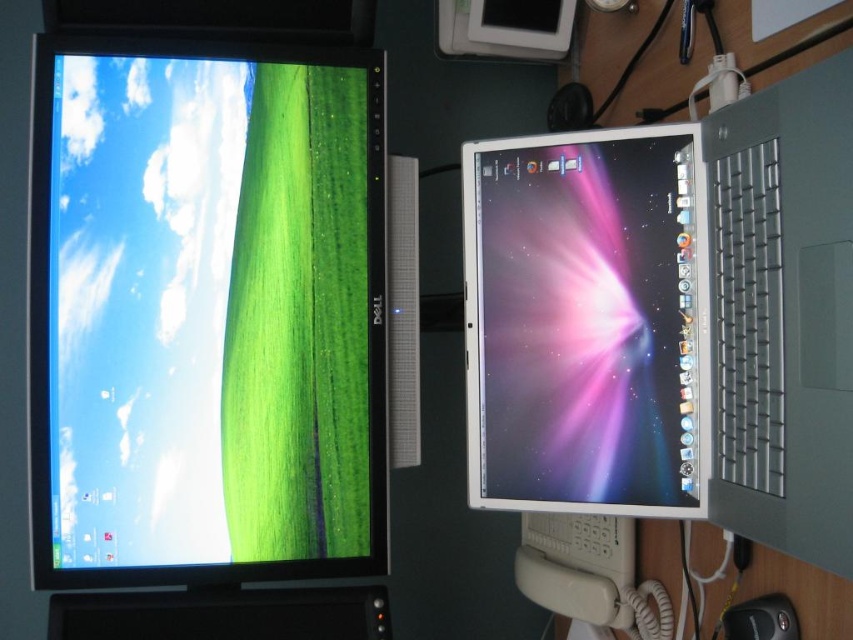
Does satin silver laptop at right appear on the left side of metallic silver laptop at center?

No, satin silver laptop at right is not to the left of metallic silver laptop at center.

Consider the image. Does satin silver laptop at right appear under metallic silver laptop at center?

Incorrect, satin silver laptop at right is not positioned below metallic silver laptop at center.

This screenshot has width=853, height=640. I want to click on satin silver laptop at right, so click(x=695, y=316).

Locate an element on the screen. This screenshot has width=853, height=640. satin silver laptop at right is located at coordinates coord(695,316).

Is matte black monitor at left thinner than satin silver laptop at right?

In fact, matte black monitor at left might be wider than satin silver laptop at right.

Find the location of a particular element. This screenshot has height=640, width=853. matte black monitor at left is located at coordinates (206, 314).

Can you confirm if matte black monitor at left is positioned above metallic silver laptop at center?

Yes.

Which is in front, point (271, 228) or point (657, 408)?

Point (657, 408) is in front.

Where is `matte black monitor at left`? The width and height of the screenshot is (853, 640). matte black monitor at left is located at coordinates (206, 314).

Find the location of a particular element. Image resolution: width=853 pixels, height=640 pixels. matte black monitor at left is located at coordinates (206, 314).